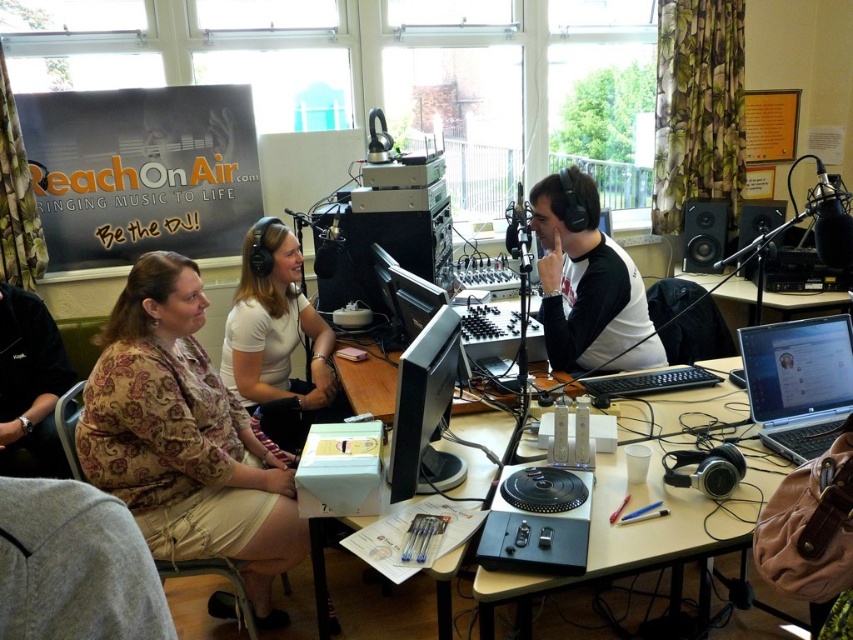
Can you confirm if white matte shirt at center is thinner than wooden table at center?

Yes, white matte shirt at center is thinner than wooden table at center.

Does white matte shirt at center have a greater height compared to wooden table at center?

Yes, white matte shirt at center is taller than wooden table at center.

Between point (262, 333) and point (780, 314), which one is positioned behind?

The point (780, 314) is more distant.

Locate an element on the screen. The width and height of the screenshot is (853, 640). white matte shirt at center is located at coordinates (277, 339).

Can you confirm if paisley-patterned blouse at left is smaller than matte black headphones at center?

No.

Between paisley-patterned blouse at left and matte black headphones at center, which one has more height?

Standing taller between the two is paisley-patterned blouse at left.

Between point (149, 460) and point (619, 356), which one is positioned behind?

Point (619, 356)

At what (x,y) coordinates should I click in order to perform the action: click on paisley-patterned blouse at left. Please return your answer as a coordinate pair (x, y). This screenshot has height=640, width=853. Looking at the image, I should click on (184, 438).

Looking at this image, between matte black headphones at center and black matte microphone at upper right, which one has more height?

matte black headphones at center

Is matte black headphones at center positioned behind black matte microphone at upper right?

Yes, it is.

Who is more forward, [601,244] or [845,232]?

Positioned in front is point [845,232].

Locate an element on the screen. matte black headphones at center is located at coordinates (587, 285).